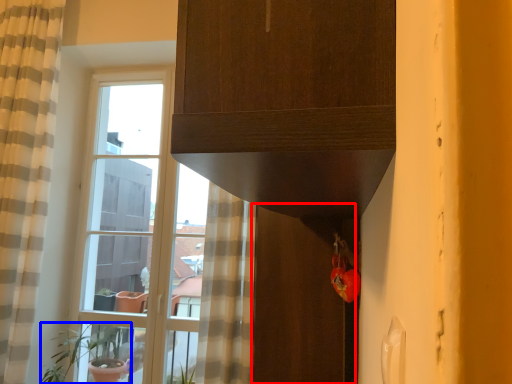
Question: Which object is further to the camera taking this photo, screen door (highlighted by a red box) or houseplant (highlighted by a blue box)?

Choices:
 (A) screen door
 (B) houseplant

Answer: (B)